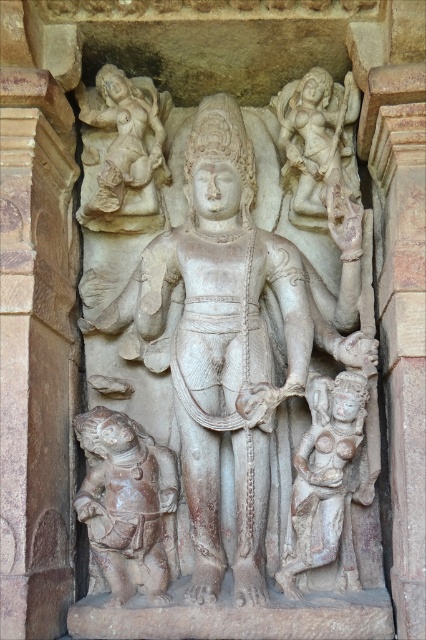
Question: Which of the following is the farthest from the observer?

Choices:
 (A) (157, 124)
 (B) (94, 540)

Answer: (A)

Question: Can you confirm if white stone statue at center is positioned below smooth stone statue at upper left?

Choices:
 (A) no
 (B) yes

Answer: (B)

Question: Is white stone figure at lower center to the left of smooth stone statue at upper left from the viewer's perspective?

Choices:
 (A) no
 (B) yes

Answer: (A)

Question: Among these points, which one is farthest from the camera?

Choices:
 (A) (141, 152)
 (B) (120, 460)

Answer: (A)

Question: Which point is closer to the camera?

Choices:
 (A) (216, 304)
 (B) (336, 403)
 (C) (103, 516)
 (D) (135, 132)

Answer: (B)

Question: Does white stone statue at center lie in front of white stone figure at lower center?

Choices:
 (A) yes
 (B) no

Answer: (A)